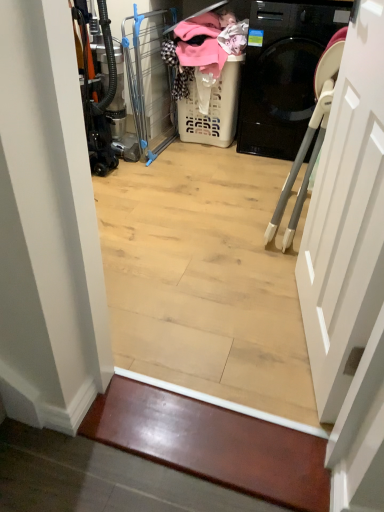
You are a GUI agent. You are given a task and a screenshot of the screen. Output one action in this format:
    pyautogui.click(x=<x>, y=<y>)
    Task: Click on the free area behind white matte door at right
    Image resolution: width=384 pixels, height=512 pixels.
    Given the screenshot: What is the action you would take?
    pyautogui.click(x=245, y=260)